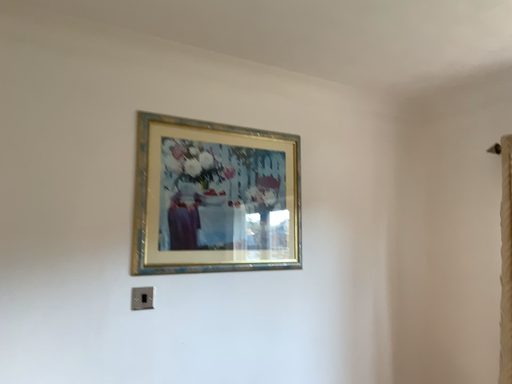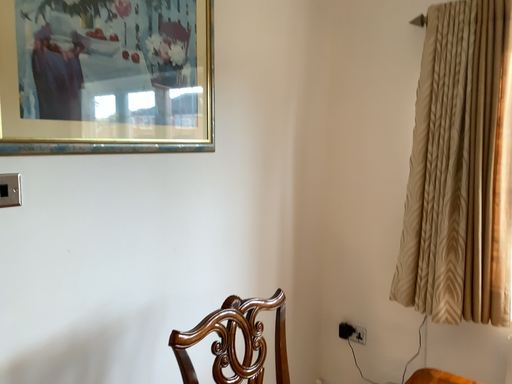
Question: How did the camera likely rotate when shooting the video?

Choices:
 (A) rotated right
 (B) rotated left

Answer: (A)